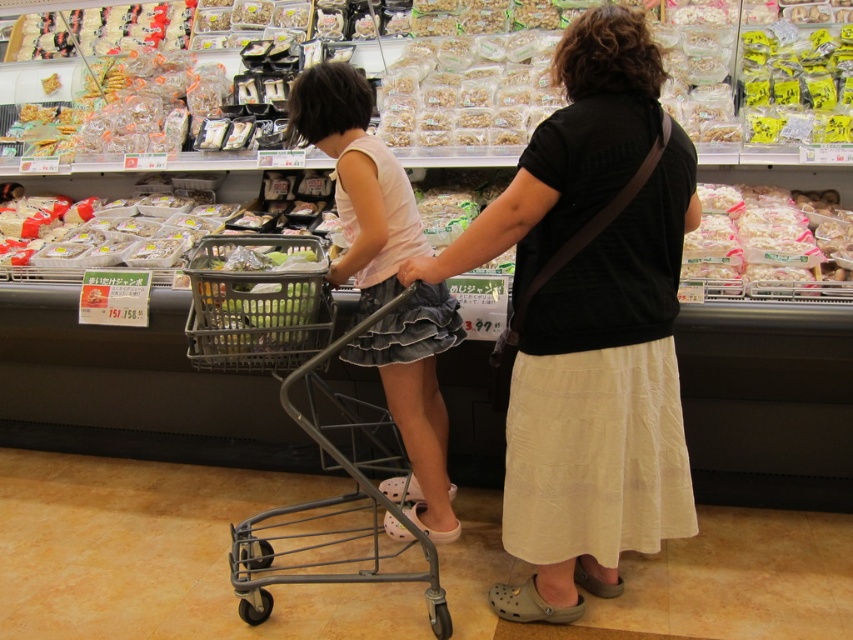
Which is in front, point (374, 237) or point (268, 353)?

Point (268, 353)

Measure the distance between matte black shirt at center and camera.

The distance of matte black shirt at center from camera is 7.03 feet.

Find the location of `matte black shirt at center`. matte black shirt at center is located at coordinates (358, 180).

Can you confirm if black cotton shirt at center is shorter than yellow plastic bag at upper right?

No, black cotton shirt at center is not shorter than yellow plastic bag at upper right.

Who is lower down, black cotton shirt at center or yellow plastic bag at upper right?

black cotton shirt at center

Who is more distant from viewer, (672, 237) or (845, 102)?

The point (845, 102) is more distant.

Locate an element on the screen. black cotton shirt at center is located at coordinates (590, 323).

What do you see at coordinates (798, 84) in the screenshot? The width and height of the screenshot is (853, 640). I see `yellow plastic bag at upper right` at bounding box center [798, 84].

Between point (746, 140) and point (103, 257), which one is positioned in front?

Point (746, 140) is in front.

Measure the distance between yellow plastic bag at upper right and camera.

8.75 feet

This screenshot has height=640, width=853. I want to click on yellow plastic bag at upper right, so click(x=798, y=84).